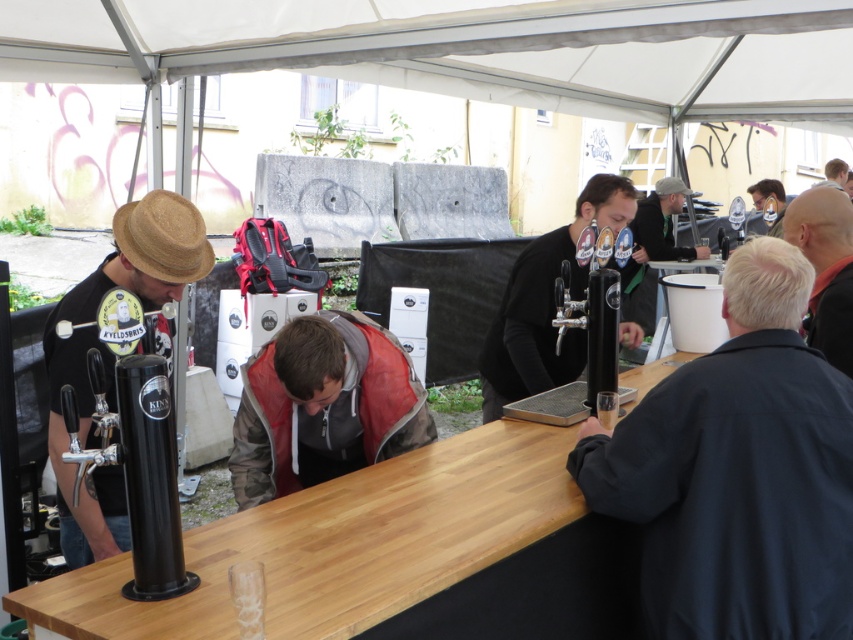
What are the coordinates of the matte black beer tap at center?

The coordinates of the matte black beer tap at center are at point (546, 304).